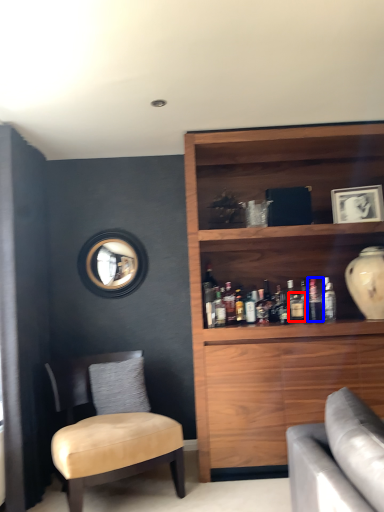
Question: Which object appears closest to the camera in this image, beverage (highlighted by a red box) or bottle (highlighted by a blue box)?

Choices:
 (A) beverage
 (B) bottle

Answer: (A)